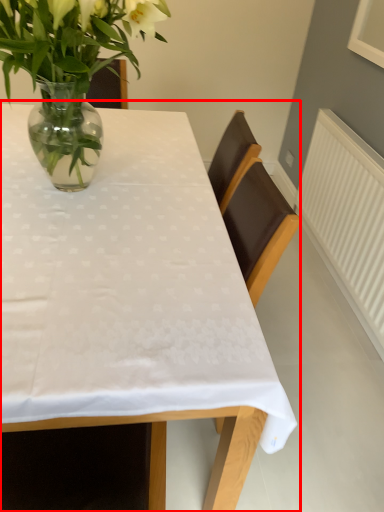
Question: From the image's perspective, where is table (annotated by the red box) located relative to houseplant?

Choices:
 (A) above
 (B) below

Answer: (B)